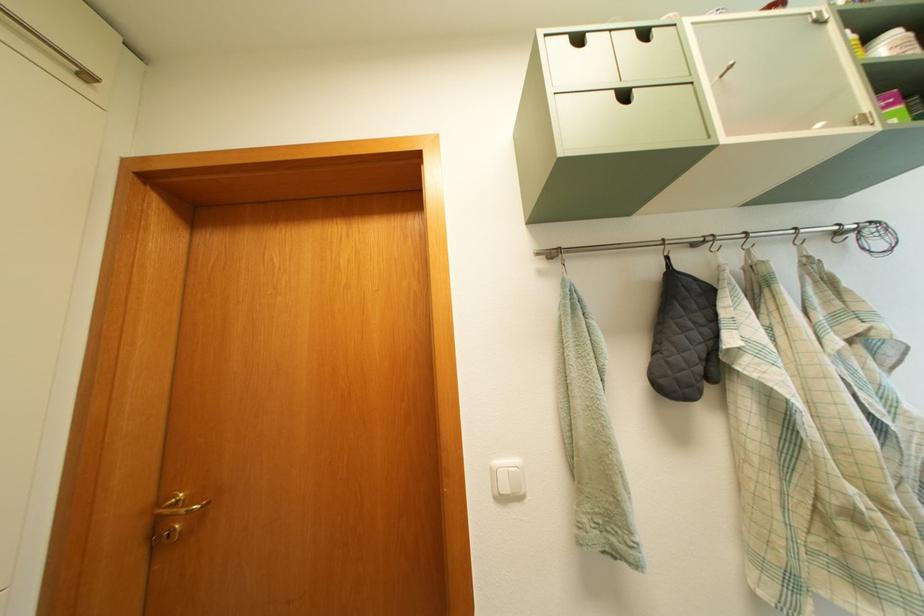
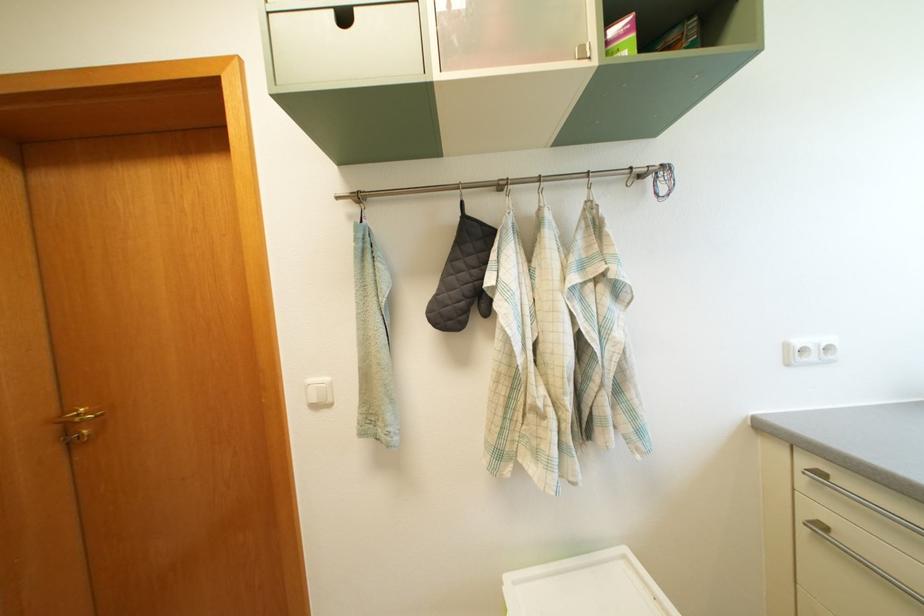
Where in the second image is the point corresponding to pixel 167 509 from the first image?

(71, 422)